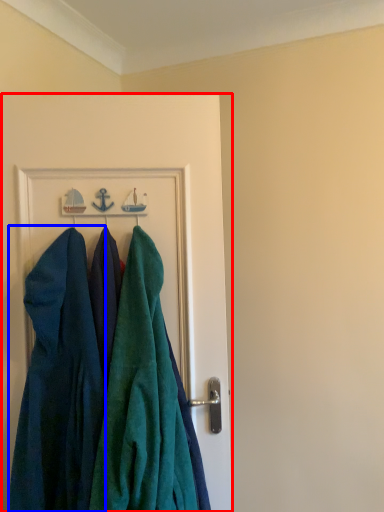
Question: Among these objects, which one is nearest to the camera, door (highlighted by a red box) or dress (highlighted by a blue box)?

Choices:
 (A) door
 (B) dress

Answer: (B)